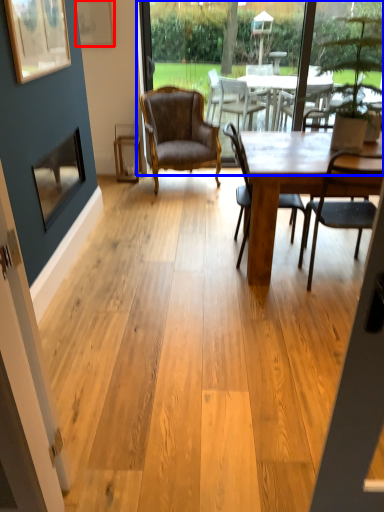
Question: Which point is further to the camera, picture frame (highlighted by a red box) or window screen (highlighted by a blue box)?

Choices:
 (A) picture frame
 (B) window screen

Answer: (B)